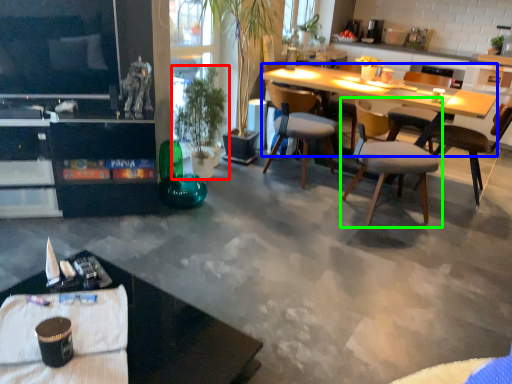
Question: Which object is the closest to the houseplant (highlighted by a red box)? Choose among these: kitchen & dining room table (highlighted by a blue box) or chair (highlighted by a green box).

Choices:
 (A) kitchen & dining room table
 (B) chair

Answer: (A)